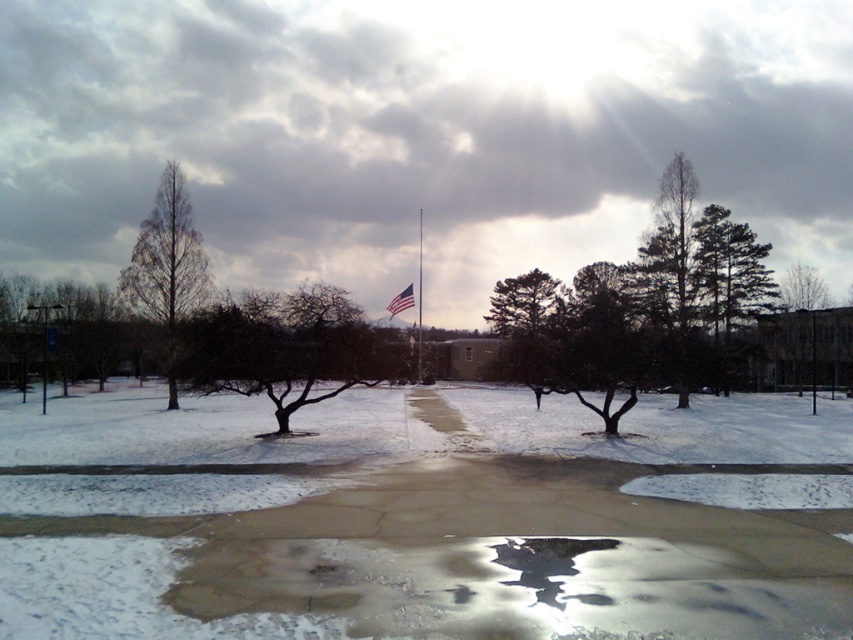
You are standing in the snowy scene looking at the flagpole and the trees. There are two points marked in the image, one at coordinates point (357,556) and another at point (799,337). Which point is nearer to you?

Point (357,556) is closer to the camera than point (799,337), so the point at coordinates point (357,556) is nearer to you.

You are a bird looking for a place to perch. You see a bare branches tree at left and a bare branches at center. Which one is taller?

The bare branches tree at left is taller than the bare branches at center.